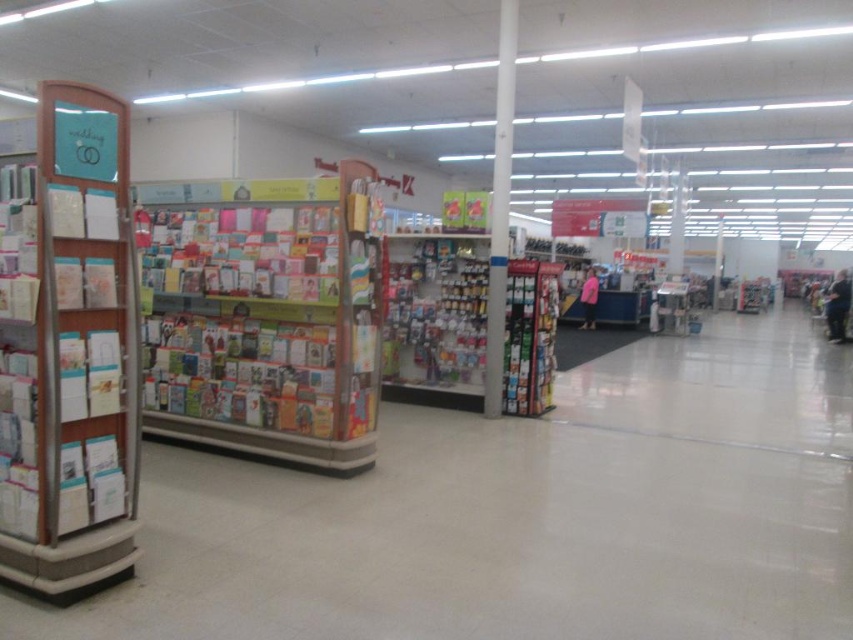
Question: Can you confirm if multicolored paper cards at center is bigger than metallic silver bookshelf at center?

Choices:
 (A) no
 (B) yes

Answer: (B)

Question: Among these objects, which one is farthest from the camera?

Choices:
 (A) pink fabric jacket at center
 (B) dark blue jeans at lower right

Answer: (A)

Question: Can you confirm if matte cardboard bookshelf at left is thinner than white glossy pillar at center?

Choices:
 (A) yes
 (B) no

Answer: (B)

Question: Among these points, which one is nearest to the camera?

Choices:
 (A) (407, 369)
 (B) (192, 419)
 (C) (840, 289)

Answer: (B)

Question: Which object appears farthest from the camera in this image?

Choices:
 (A) white glossy pillar at center
 (B) multicolored paper cards at center

Answer: (A)

Question: Is matte paper greeting cards at center above white glossy pillar at center?

Choices:
 (A) yes
 (B) no

Answer: (B)